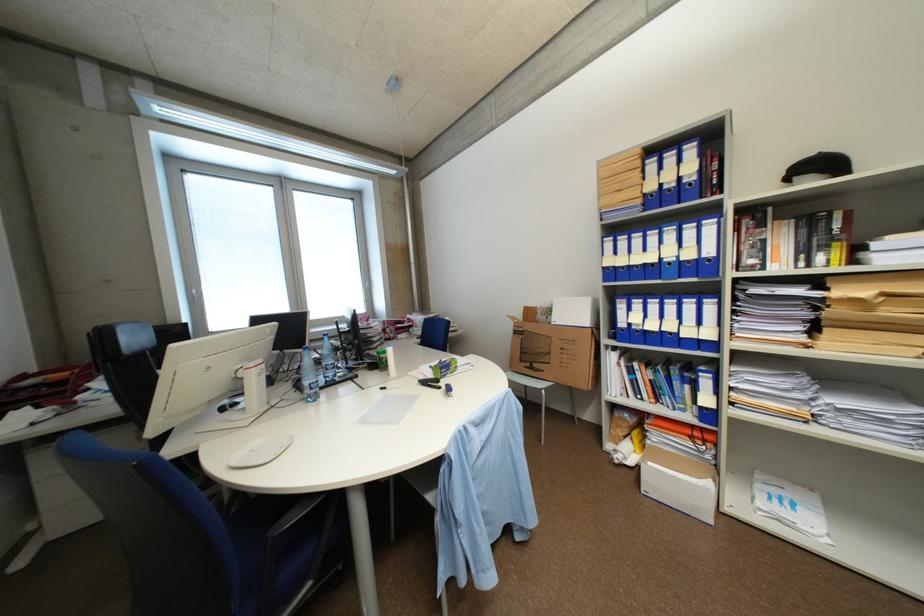
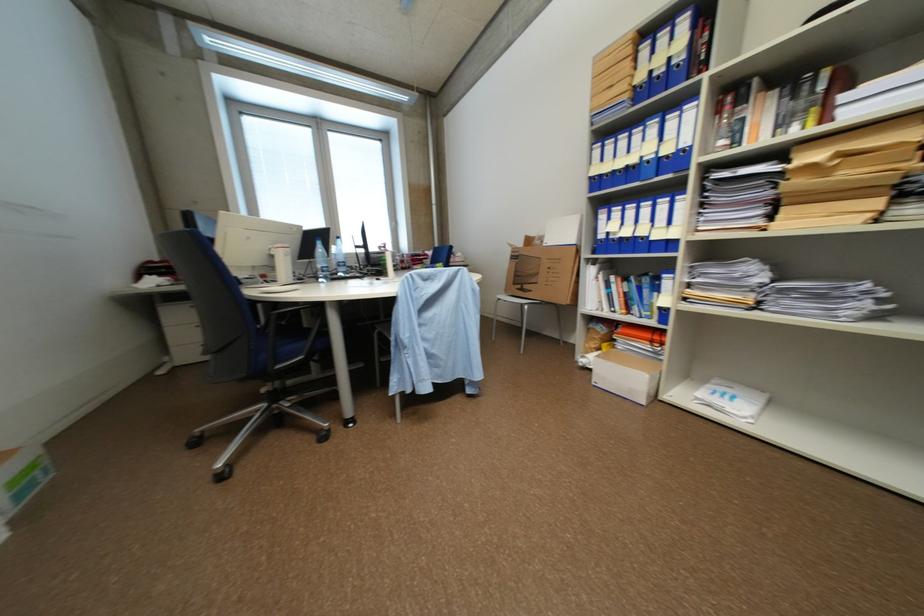
Question: The camera is either moving clockwise (left) or counter-clockwise (right) around the object. The first image is from the beginning of the video and the second image is from the end. Is the camera moving left or right when shooting the video?

Choices:
 (A) Left
 (B) Right

Answer: (B)